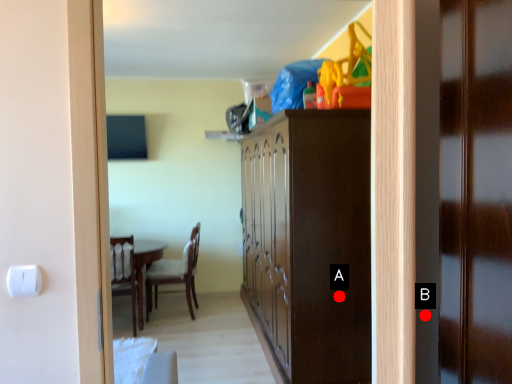
Question: Two points are circled on the image, labeled by A and B beside each circle. Which point is closer to the camera?

Choices:
 (A) A is closer
 (B) B is closer

Answer: (B)